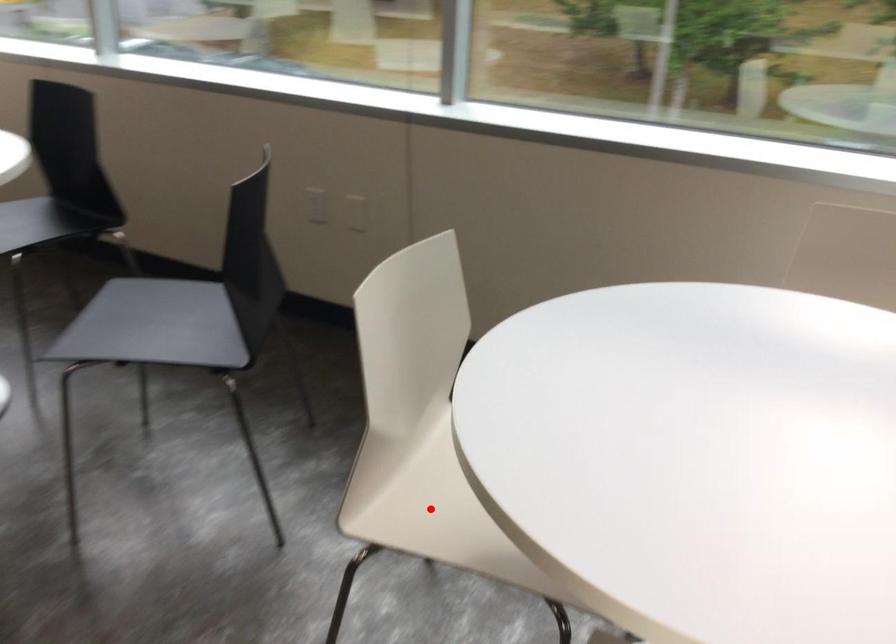
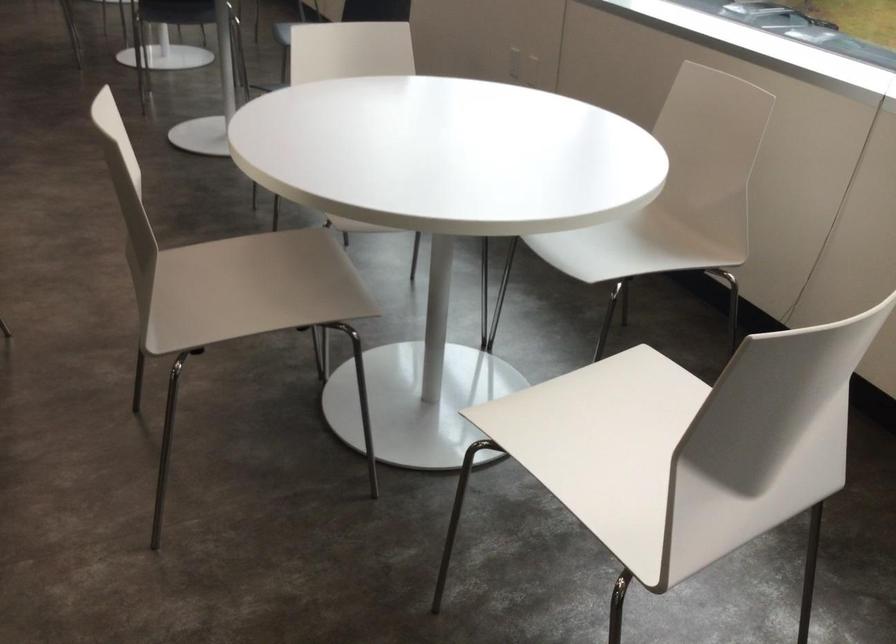
Question: I am providing you with two images of the same scene from different viewpoints. A red point is marked on the first image. Is the red point's position out of view in image 2?

Choices:
 (A) Yes
 (B) No

Answer: (A)